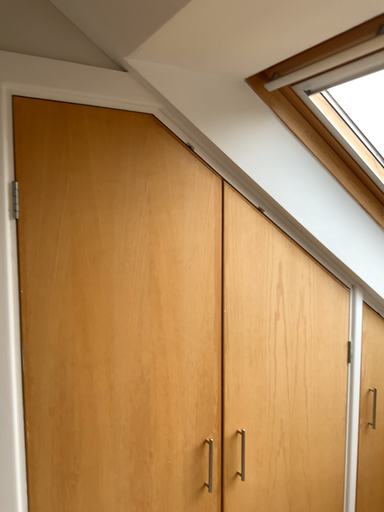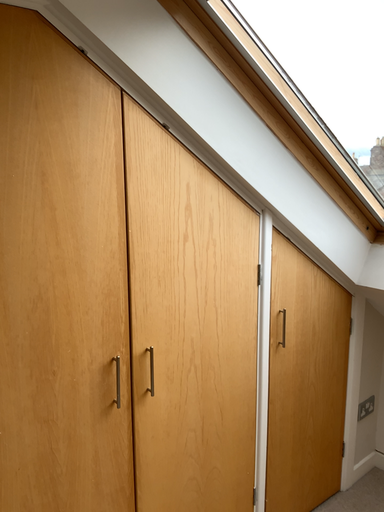
Question: How did the camera likely rotate when shooting the video?

Choices:
 (A) rotated right
 (B) rotated left

Answer: (A)